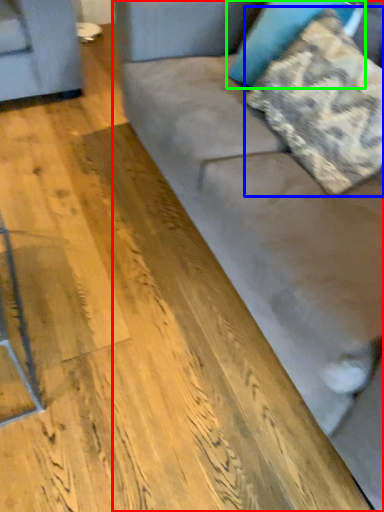
Question: Estimate the real-world distances between objects in this image. Which object is closer to studio couch (highlighted by a red box), pillow (highlighted by a blue box) or pillow (highlighted by a green box)?

Choices:
 (A) pillow
 (B) pillow

Answer: (A)